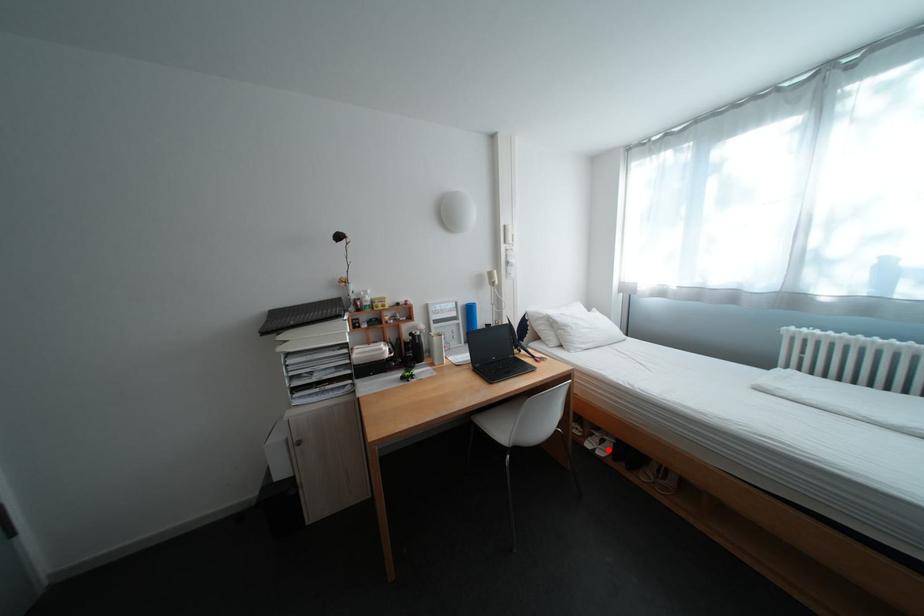
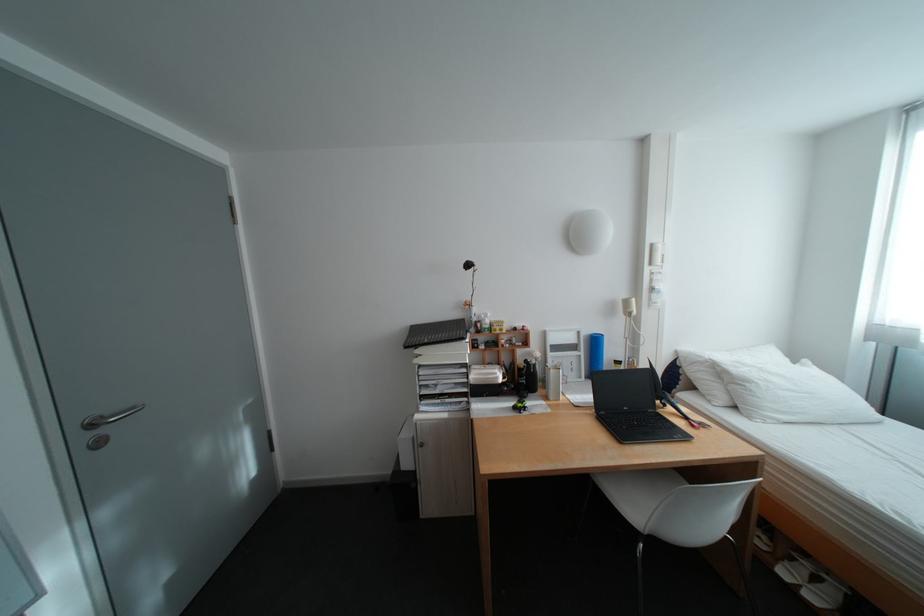
Where in the second image is the point corresponding to the highlighted location from the first image?

(813, 586)